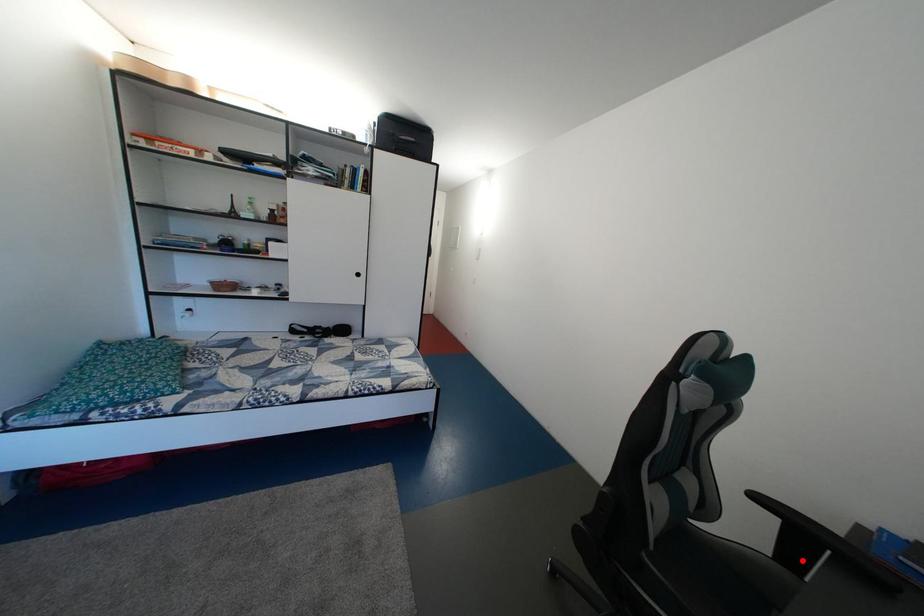
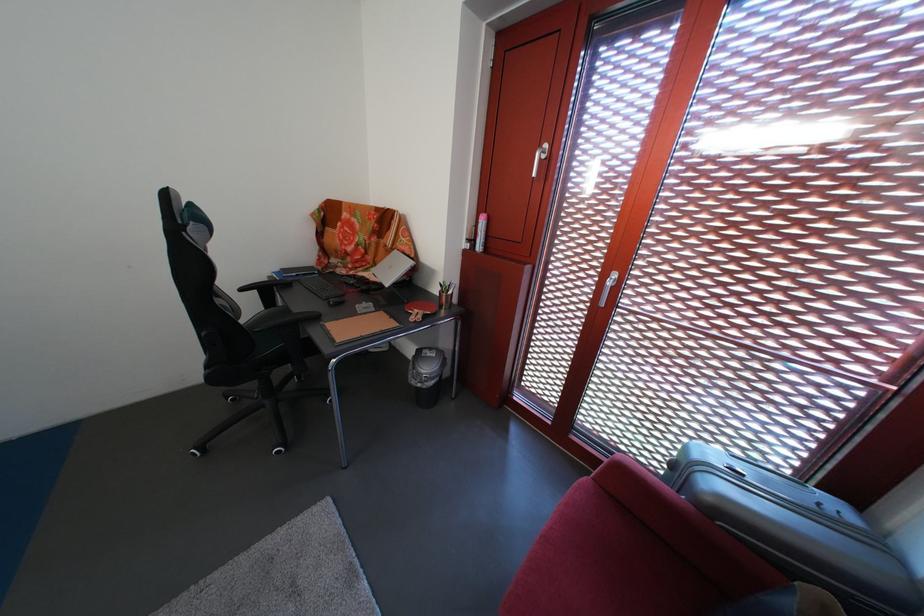
Question: I am providing you with two images of the same scene from different viewpoints. A red point is marked on the first image. Is the red point's position out of view in image 2?

Choices:
 (A) Yes
 (B) No

Answer: (B)